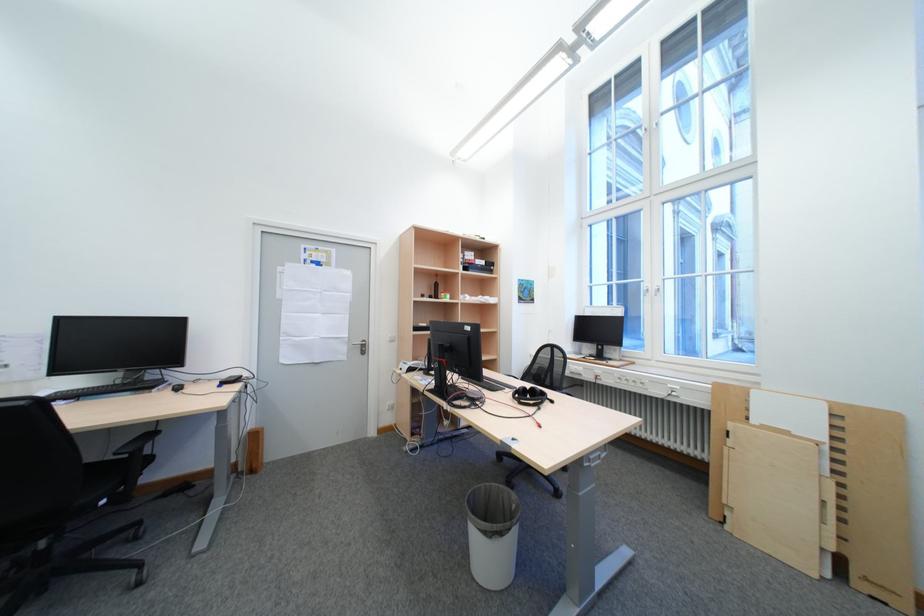
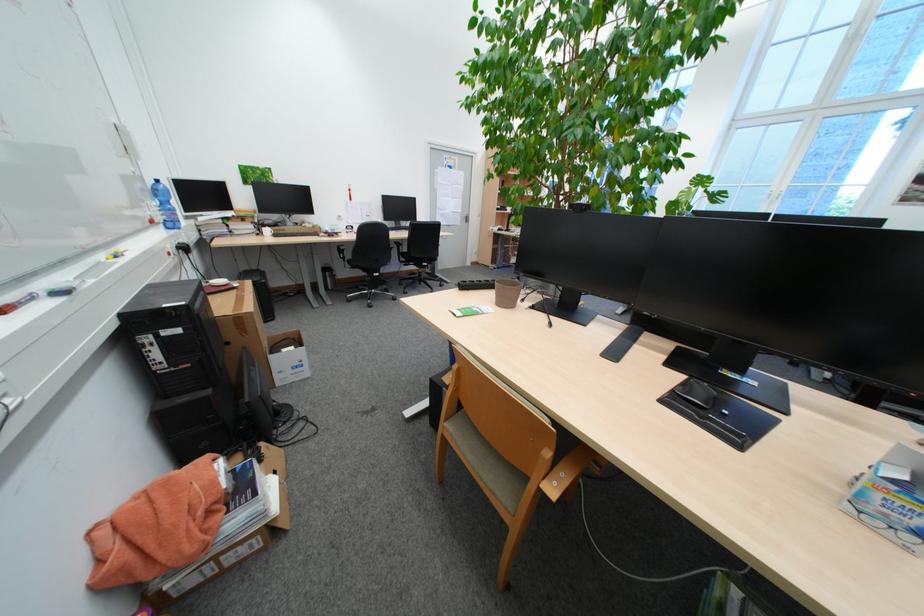
The images are taken continuously from a first-person perspective. In which direction are you moving?

The movement direction of the cameraman is left, backward.